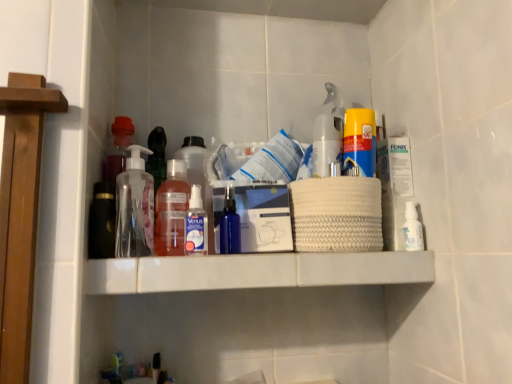
Question: From the image's perspective, relative to transparent plastic pump bottle at center, which is the first bottle in left-to-right order, is translucent plastic bottle at center, the 5th bottle in the right-to-left sequence, above or below?

Choices:
 (A) below
 (B) above

Answer: (A)

Question: Would you say translucent plastic bottle at center, the 5th bottle in the right-to-left sequence, is inside or outside transparent plastic pump bottle at center, which is the first bottle in left-to-right order?

Choices:
 (A) outside
 (B) inside

Answer: (A)

Question: Considering the real-world distances, which object is closest to the clear plastic spray bottle at right, the sixth bottle viewed from the left?

Choices:
 (A) transparent plastic pump bottle at center, placed as the 6th bottle when sorted from right to left
 (B) translucent plastic bottle at center, marked as the second bottle in a left-to-right arrangement
 (C) translucent plastic bottle at center, placed as the fourth bottle when sorted from right to left
 (D) clear plastic spray bottle at center, the fourth bottle viewed from the left
 (E) white matte shelf at center

Answer: (E)

Question: Which of these objects is positioned farthest from the clear plastic spray bottle at right, acting as the 1th bottle starting from the right?

Choices:
 (A) white matte shelf at center
 (B) clear plastic spray bottle at center, positioned as the 3th bottle in right-to-left order
 (C) translucent plastic bottle at center, which ranks as the 3th bottle in left-to-right order
 (D) translucent plastic bottle at center, the 5th bottle in the right-to-left sequence
 (E) yellow matte canister at upper center

Answer: (D)